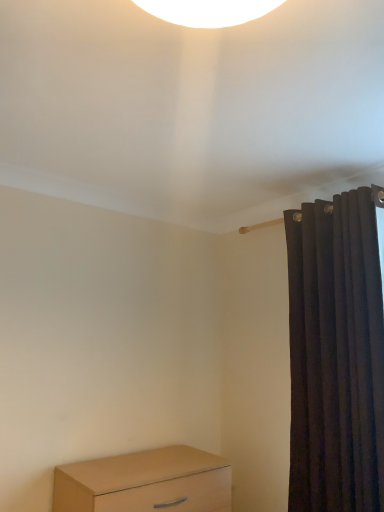
Question: Considering the positions of light brown wood chest of drawers at lower left and dark velvet curtain at right in the image, is light brown wood chest of drawers at lower left wider or thinner than dark velvet curtain at right?

Choices:
 (A) wide
 (B) thin

Answer: (A)

Question: Is light brown wood chest of drawers at lower left spatially inside dark velvet curtain at right, or outside of it?

Choices:
 (A) outside
 (B) inside

Answer: (A)

Question: Considering the relative positions of light brown wood chest of drawers at lower left and dark velvet curtain at right in the image provided, is light brown wood chest of drawers at lower left to the left or to the right of dark velvet curtain at right?

Choices:
 (A) right
 (B) left

Answer: (B)

Question: Is dark velvet curtain at right wider or thinner than light brown wood chest of drawers at lower left?

Choices:
 (A) thin
 (B) wide

Answer: (A)

Question: Considering the positions of point (309, 450) and point (104, 463), is point (309, 450) closer or farther from the camera than point (104, 463)?

Choices:
 (A) farther
 (B) closer

Answer: (B)

Question: From the image's perspective, relative to light brown wood chest of drawers at lower left, is dark velvet curtain at right above or below?

Choices:
 (A) below
 (B) above

Answer: (B)

Question: Is dark velvet curtain at right taller or shorter than light brown wood chest of drawers at lower left?

Choices:
 (A) tall
 (B) short

Answer: (A)